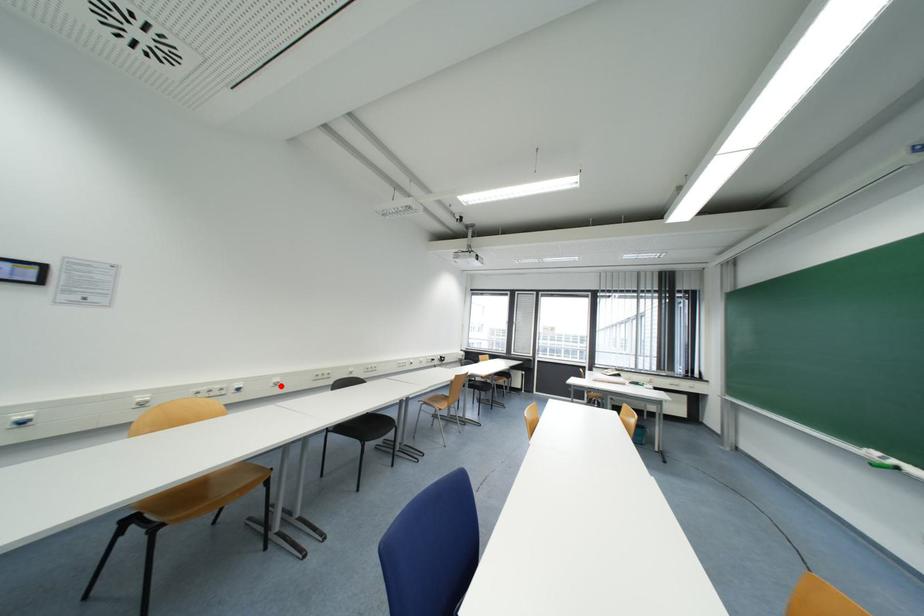
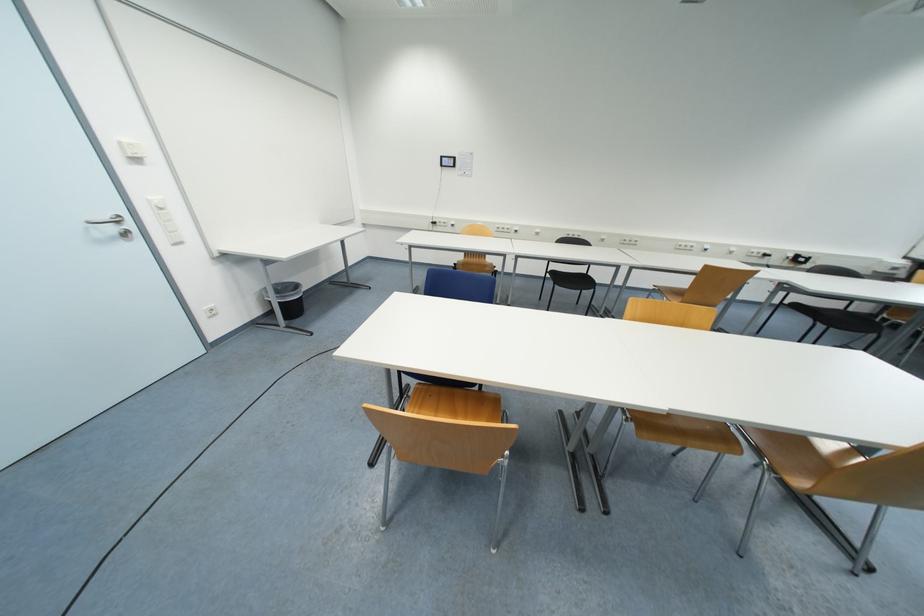
Where in the second image is the point corresponding to the highlighted location from the first image?

(541, 236)